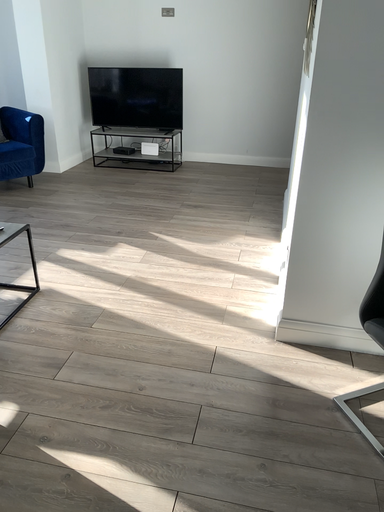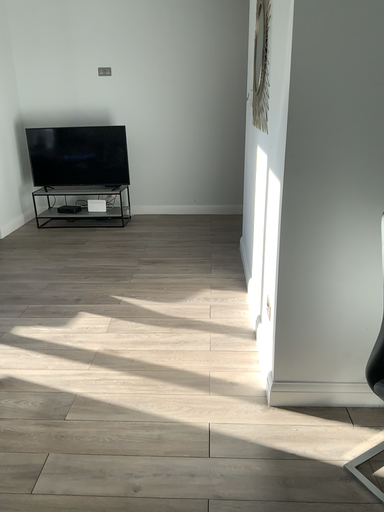
Question: Which way did the camera rotate in the video?

Choices:
 (A) rotated left
 (B) rotated right

Answer: (B)